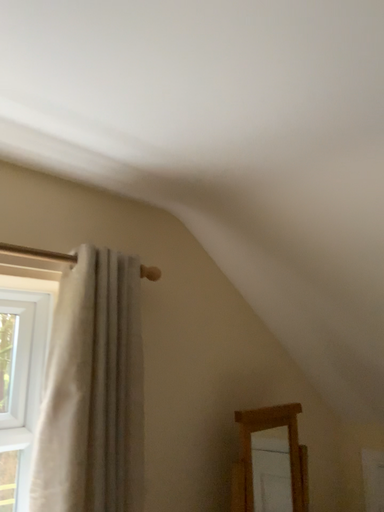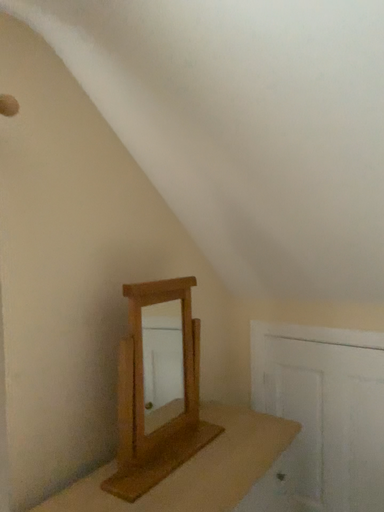
Question: Which way did the camera rotate in the video?

Choices:
 (A) rotated downward
 (B) rotated upward

Answer: (A)